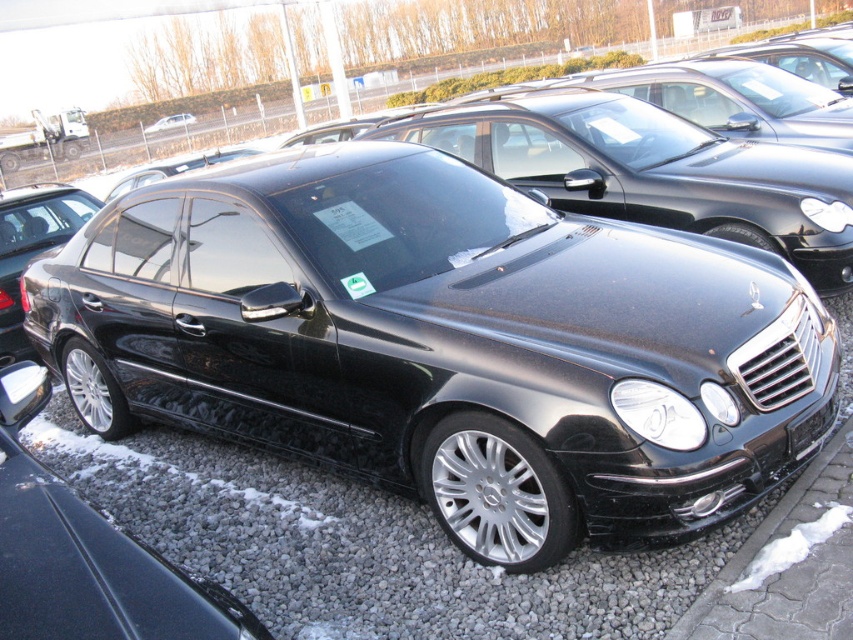
You are a delivery person who needs to park your van in the parking lot. The van is 7 meters long. Is there enough space between the gray gravel at lower center and the matte black sedan at center to park your van?

The distance between the gray gravel at lower center and the matte black sedan at center is 36.43 meters, which is more than enough to park a van that is 7 meters long.

You are standing at the camera position and want to walk to the point marked as point [196,548]. How far will you have to walk?

The distance of point [196,548] from camera is 3.50 meters, so you will have to walk 3.50 meters to reach point [196,548].

You are a photographer trying to capture the glossy black sedan at center and the shiny black sedan at center in a single shot. Since both cars are at the center, how can you determine which one is lower in the frame?

The glossy black sedan at center is located below the shiny black sedan at center, so in the frame, the glossy black sedan at center appears lower than the shiny black sedan at center.